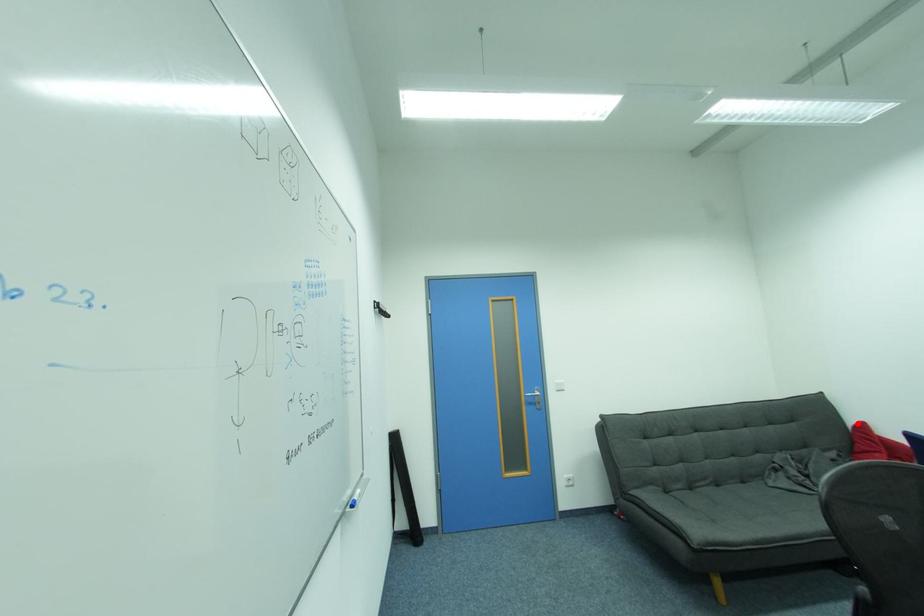
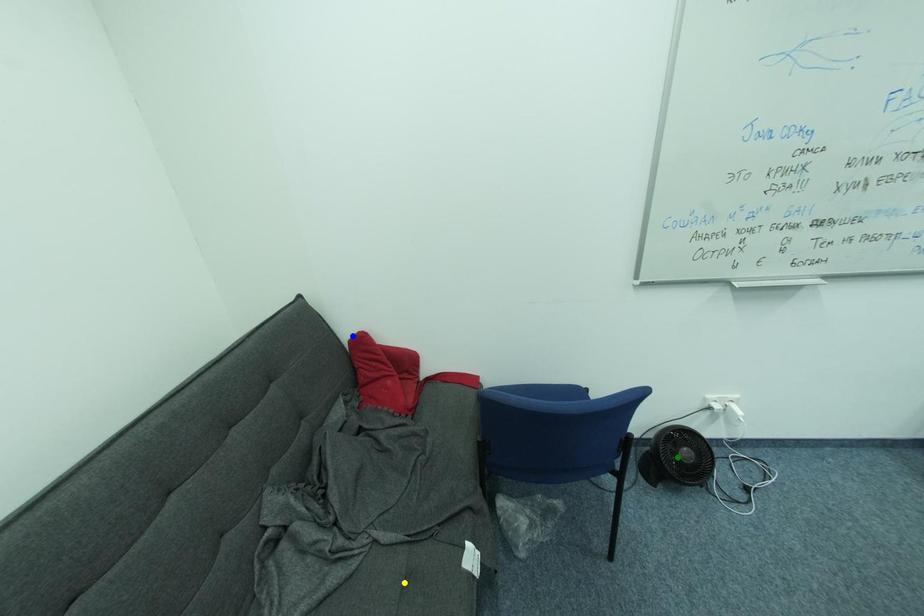
Question: I am providing you with two images of the same scene from different viewpoints. A red point is marked on the first image. You are given multiple points on the second image. Which point in image 2 represents the same 3d spot as the red point in image 1?

Choices:
 (A) green point
 (B) blue point
 (C) yellow point

Answer: (B)